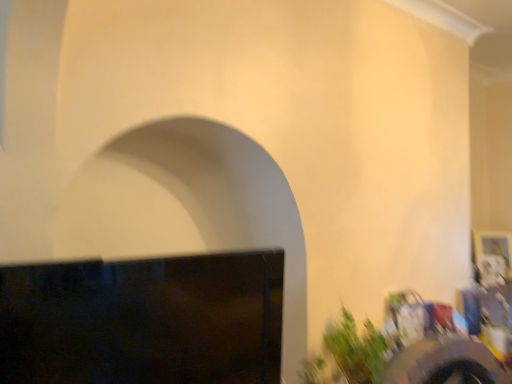
Measure the distance between point (359, 383) and camera.

5.86 feet.

The height and width of the screenshot is (384, 512). What do you see at coordinates (358, 349) in the screenshot?
I see `green leafy plant at lower right` at bounding box center [358, 349].

The height and width of the screenshot is (384, 512). Find the location of `green leafy plant at lower right`. green leafy plant at lower right is located at coordinates (358, 349).

The height and width of the screenshot is (384, 512). I want to click on green leafy plant at lower right, so click(x=358, y=349).